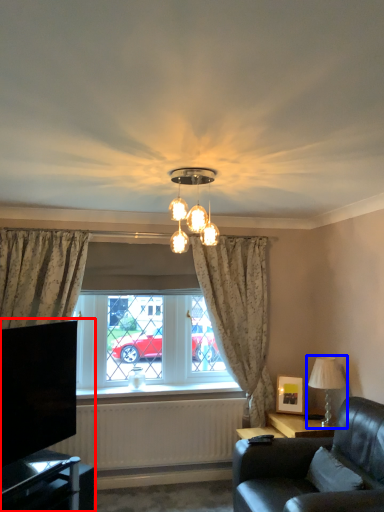
Question: Among these objects, which one is nearest to the camera, entertainment center (highlighted by a red box) or lamp (highlighted by a blue box)?

Choices:
 (A) entertainment center
 (B) lamp

Answer: (A)